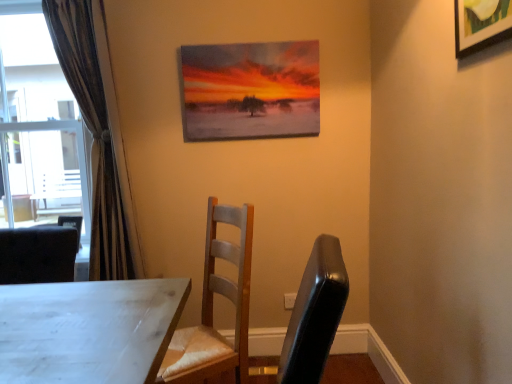
Identify the location of wooden chair at center. (212, 307).

The width and height of the screenshot is (512, 384). Describe the element at coordinates (98, 134) in the screenshot. I see `brown textured curtain at left` at that location.

This screenshot has width=512, height=384. Identify the location of wooden picture frame at upper right, acting as the second picture frame starting from the left. (481, 24).

Would you say brown textured curtain at left is part of wooden picture frame at upper right, acting as the second picture frame starting from the left,'s contents?

No, brown textured curtain at left is not a part of wooden picture frame at upper right, acting as the second picture frame starting from the left.

From the picture: In terms of height, does wooden picture frame at upper right, acting as the second picture frame starting from the left, look taller or shorter compared to brown textured curtain at left?

wooden picture frame at upper right, acting as the second picture frame starting from the left, is shorter than brown textured curtain at left.

From a real-world perspective, does wooden picture frame at upper right, which appears as the 1th picture frame when viewed from the right, stand above brown textured curtain at left?

Indeed, from a real-world perspective, wooden picture frame at upper right, which appears as the 1th picture frame when viewed from the right, stands above brown textured curtain at left.

Does wooden picture frame at upper right, acting as the second picture frame starting from the left, come in front of brown textured curtain at left?

That is True.

Identify the location of window behind the wooden chair at center. The width and height of the screenshot is (512, 384). (41, 128).

Which is more to the left, wooden chair at center or transparent glass window at left?

transparent glass window at left.

Is point (211, 290) less distant than point (53, 148)?

Yes.

Is wooden chair at center directly adjacent to transparent glass window at left?

wooden chair at center is not next to transparent glass window at left, and they're not touching.

Between oil painting at upper center, which appears as the 2th picture frame when viewed from the right, and brown textured curtain at left, which one appears on the right side from the viewer's perspective?

oil painting at upper center, which appears as the 2th picture frame when viewed from the right, is more to the right.

How far apart are oil painting at upper center, which appears as the 2th picture frame when viewed from the right, and brown textured curtain at left?

oil painting at upper center, which appears as the 2th picture frame when viewed from the right, and brown textured curtain at left are 27.98 inches apart from each other.

Which of these two, oil painting at upper center, acting as the second picture frame starting from the front, or brown textured curtain at left, stands taller?

Standing taller between the two is brown textured curtain at left.

From the image's perspective, is oil painting at upper center, which appears as the 2th picture frame when viewed from the right, located above brown textured curtain at left?

Yes, from the image's perspective, oil painting at upper center, which appears as the 2th picture frame when viewed from the right, is above brown textured curtain at left.

Measure the distance between transparent glass window at left and brown textured curtain at left.

transparent glass window at left and brown textured curtain at left are 31.02 inches apart from each other.

Consider the image. Is transparent glass window at left situated inside brown textured curtain at left or outside?

transparent glass window at left exists outside the volume of brown textured curtain at left.

Between transparent glass window at left and brown textured curtain at left, which one is positioned in front?

brown textured curtain at left.

Consider the image. Does transparent glass window at left have a greater height compared to brown textured curtain at left?

In fact, transparent glass window at left may be shorter than brown textured curtain at left.

Based on the photo, is oil painting at upper center, acting as the second picture frame starting from the front, touching wooden chair at center?

No, oil painting at upper center, acting as the second picture frame starting from the front, is not in contact with wooden chair at center.

Which is more to the left, oil painting at upper center, acting as the second picture frame starting from the front, or wooden chair at center?

wooden chair at center.

Which is more distant, (x=263, y=78) or (x=243, y=291)?

The point (x=263, y=78) is farther from the camera.

Can you tell me how much oil painting at upper center, which is counted as the first picture frame, starting from the left, and wooden chair at center differ in facing direction?

57.2 degrees.

Is wooden picture frame at upper right, which appears as the 1th picture frame when viewed from the right, positioned beyond the bounds of transparent glass window at left?

Absolutely, wooden picture frame at upper right, which appears as the 1th picture frame when viewed from the right, is external to transparent glass window at left.

Could you measure the distance between wooden picture frame at upper right, which ranks as the first picture frame in front-to-back order, and transparent glass window at left?

wooden picture frame at upper right, which ranks as the first picture frame in front-to-back order, and transparent glass window at left are 8.71 feet apart.

Is wooden picture frame at upper right, which is the 2th picture frame from back to front, at the right side of transparent glass window at left?

Indeed, wooden picture frame at upper right, which is the 2th picture frame from back to front, is positioned on the right side of transparent glass window at left.

From the picture: From the image's perspective, which is above, wooden picture frame at upper right, acting as the second picture frame starting from the left, or transparent glass window at left?

wooden picture frame at upper right, acting as the second picture frame starting from the left, is shown above in the image.

Where is `picture frame lying above the wooden picture frame at upper right, which appears as the 1th picture frame when viewed from the right (from the image's perspective)`? This screenshot has height=384, width=512. picture frame lying above the wooden picture frame at upper right, which appears as the 1th picture frame when viewed from the right (from the image's perspective) is located at coordinates (250, 90).

Is wooden picture frame at upper right, which appears as the 1th picture frame when viewed from the right, completely or partially outside of oil painting at upper center, the 1th picture frame positioned from the back?

Yes, wooden picture frame at upper right, which appears as the 1th picture frame when viewed from the right, is outside of oil painting at upper center, the 1th picture frame positioned from the back.

Between wooden picture frame at upper right, which is the 2th picture frame from back to front, and oil painting at upper center, which appears as the 2th picture frame when viewed from the right, which one has less height?

wooden picture frame at upper right, which is the 2th picture frame from back to front.

At what (x,y) coordinates should I click in order to perform the action: click on the 1st picture frame above the brown textured curtain at left (from the image's perspective). Please return your answer as a coordinate pair (x, y). Image resolution: width=512 pixels, height=384 pixels. Looking at the image, I should click on (481, 24).

The height and width of the screenshot is (384, 512). I want to click on window that is on the left side of wooden chair at center, so click(41, 128).

Considering their positions, is oil painting at upper center, which appears as the 2th picture frame when viewed from the right, positioned closer to brown textured curtain at left than transparent glass window at left?

Based on the image, oil painting at upper center, which appears as the 2th picture frame when viewed from the right, appears to be nearer to brown textured curtain at left.

From the image, which object appears to be nearer to brown textured curtain at left, transparent glass window at left or wooden picture frame at upper right, acting as the second picture frame starting from the left?

The object closer to brown textured curtain at left is transparent glass window at left.

From the image, which object appears to be farther from brown textured curtain at left, wooden chair at center or transparent glass window at left?

Among the two, wooden chair at center is located further to brown textured curtain at left.

In the scene shown: Estimate the real-world distances between objects in this image. Which object is closer to transparent glass window at left, wooden picture frame at upper right, acting as the second picture frame starting from the left, or brown textured curtain at left?

brown textured curtain at left.

Looking at the image, which one is located closer to wooden chair at center, transparent glass window at left or oil painting at upper center, the 1th picture frame positioned from the back?

oil painting at upper center, the 1th picture frame positioned from the back, lies closer to wooden chair at center than the other object.

Estimate the real-world distances between objects in this image. Which object is further from wooden picture frame at upper right, which ranks as the first picture frame in front-to-back order, wooden chair at center or oil painting at upper center, which is counted as the first picture frame, starting from the left?

wooden chair at center is positioned further to the anchor wooden picture frame at upper right, which ranks as the first picture frame in front-to-back order.

Looking at the image, which one is located closer to oil painting at upper center, acting as the second picture frame starting from the front, transparent glass window at left or brown textured curtain at left?

brown textured curtain at left is closer to oil painting at upper center, acting as the second picture frame starting from the front.

When comparing their distances from transparent glass window at left, does wooden chair at center or brown textured curtain at left seem closer?

The object closer to transparent glass window at left is brown textured curtain at left.

You are a GUI agent. You are given a task and a screenshot of the screen. Output one action in this format:
    pyautogui.click(x=<x>, y=<y>)
    Task: Click on the chair between transparent glass window at left and oil painting at upper center, which appears as the 2th picture frame when viewed from the right
    This screenshot has height=384, width=512.
    Given the screenshot: What is the action you would take?
    pyautogui.click(x=212, y=307)

I want to click on chair between transparent glass window at left and wooden picture frame at upper right, which is the 2th picture frame from back to front, so click(212, 307).

Where is `curtain that lies between transparent glass window at left and wooden chair at center from top to bottom`? curtain that lies between transparent glass window at left and wooden chair at center from top to bottom is located at coordinates (98, 134).

This screenshot has height=384, width=512. I want to click on picture frame between transparent glass window at left and wooden picture frame at upper right, acting as the second picture frame starting from the left, in the horizontal direction, so click(250, 90).